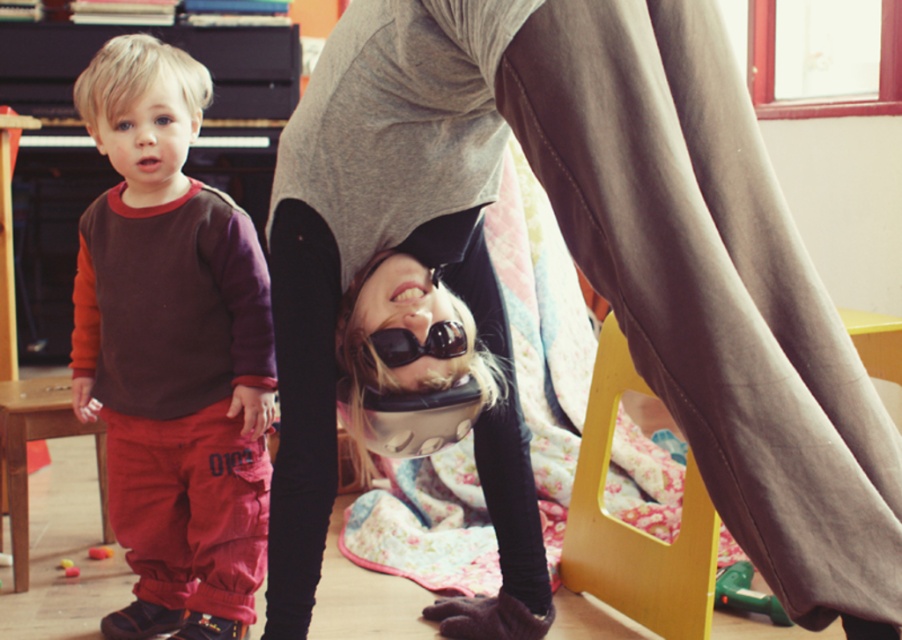
Question: Does black matte goggles at center have a lesser width compared to rubberized yellow toy at lower left?

Choices:
 (A) no
 (B) yes

Answer: (A)

Question: Which of the following is the farthest from the observer?

Choices:
 (A) (95, 552)
 (B) (374, 339)
 (C) (145, 198)
 (D) (560, 13)

Answer: (A)

Question: Observing the image, what is the correct spatial positioning of gray fabric pants at center in reference to matte brown sweatshirt at left?

Choices:
 (A) below
 (B) above

Answer: (A)

Question: Is matte brown sweatshirt at left positioned behind rubberized yellow toy at lower left?

Choices:
 (A) yes
 (B) no

Answer: (B)

Question: Which is farther from the gray fabric pants at center?

Choices:
 (A) black matte goggles at center
 (B) rubberized yellow toy at lower left
 (C) matte brown sweatshirt at left

Answer: (B)

Question: Among these objects, which one is nearest to the camera?

Choices:
 (A) black matte goggles at center
 (B) rubberized yellow toy at lower left

Answer: (A)